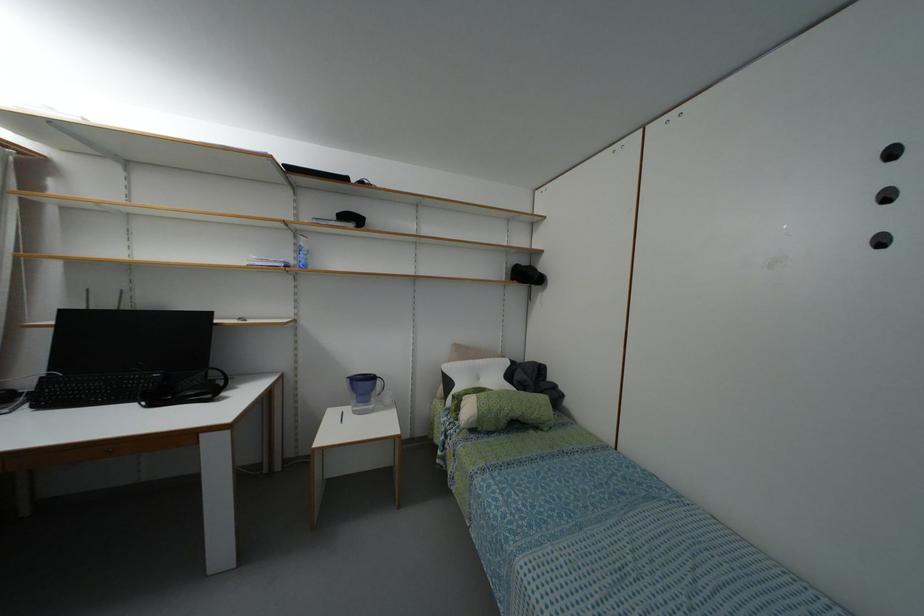
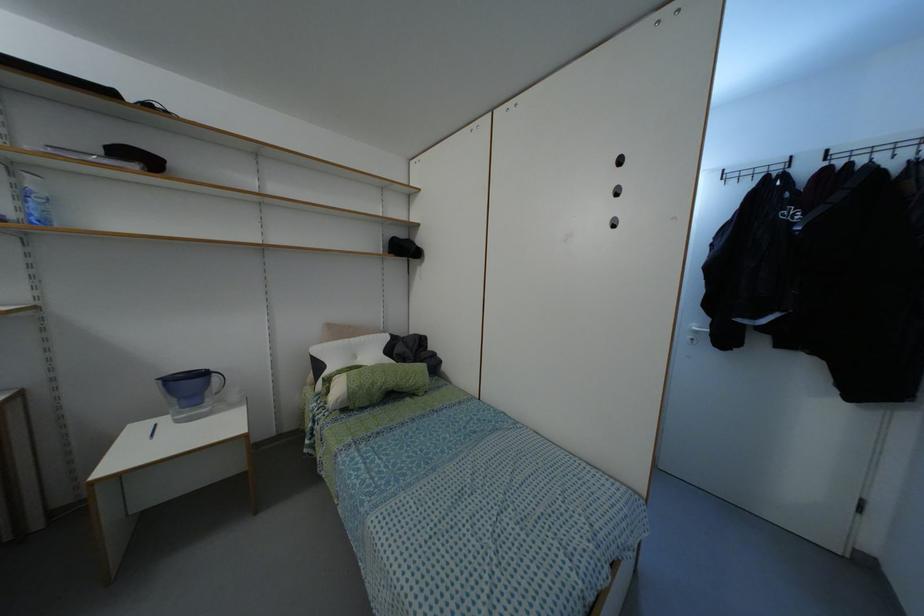
Where in the second image is the point corresponding to pixel 378 382 from the first image?

(214, 378)